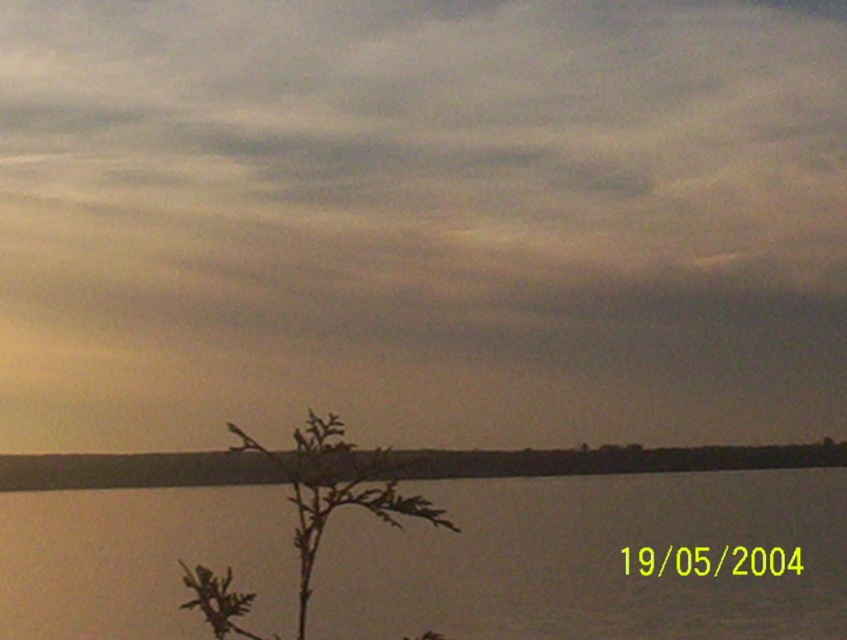
You are a photographer trying to capture the scene. You want to ensure that the gray matte cloud at upper center and the transparent water at bottom are both visible in your shot. Given their sizes, which object will occupy more space in your photo?

The gray matte cloud at upper center will occupy more space in the photo because it is bigger than the transparent water at bottom.

You are a photographer adjusting your camera settings to focus on two points in the scene. The first point is at coordinates point (427, 348) and the second point is at point (26, 625). Which point should you focus on first if you want to ensure both points are in sharp focus?

You should focus on point (427, 348) first because it is closer to the camera than point (26, 625), allowing for better depth of field coverage.

You are standing at the center of the image and want to move towards the two points labeled as point (371, 554) and point (358, 484). Which point is closer to you?

Point (358, 484) is closer to you because it is in front of point (371, 554).